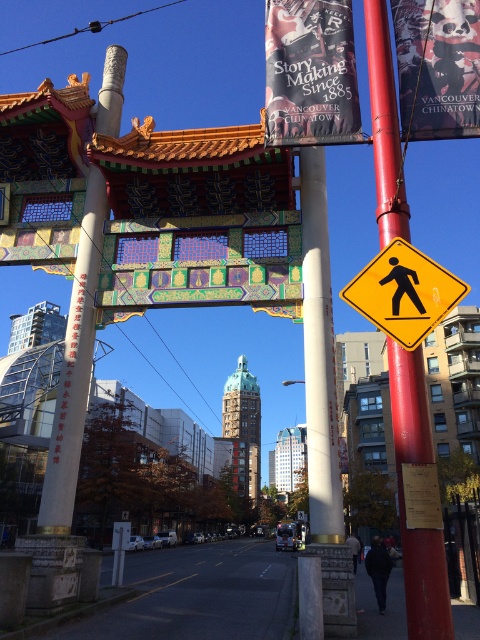
Question: Is smooth red pole at right smaller than yellow matte pedestrian crossing sign at right?

Choices:
 (A) yes
 (B) no

Answer: (B)

Question: Can you confirm if matte paper poster at upper right is positioned to the left of yellow matte pedestrian crossing sign at right?

Choices:
 (A) no
 (B) yes

Answer: (B)

Question: Is matte paper poster at upper right wider than yellow matte pedestrian crossing sign at right?

Choices:
 (A) no
 (B) yes

Answer: (A)

Question: Among these points, which one is nearest to the camera?

Choices:
 (A) pyautogui.click(x=408, y=96)
 (B) pyautogui.click(x=302, y=60)
 (C) pyautogui.click(x=463, y=288)
 (D) pyautogui.click(x=396, y=442)

Answer: (D)

Question: Among these objects, which one is nearest to the camera?

Choices:
 (A) yellow matte pedestrian crossing sign at right
 (B) black fabric banner at upper center

Answer: (A)

Question: Considering the real-world distances, which object is closest to the smooth red pole at right?

Choices:
 (A) yellow matte pedestrian crossing sign at right
 (B) black fabric banner at upper center

Answer: (A)